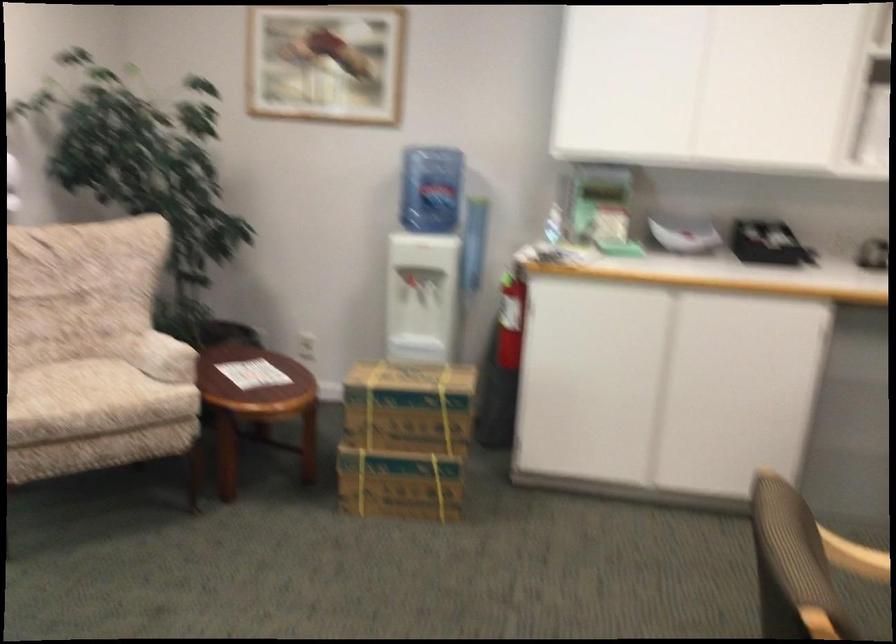
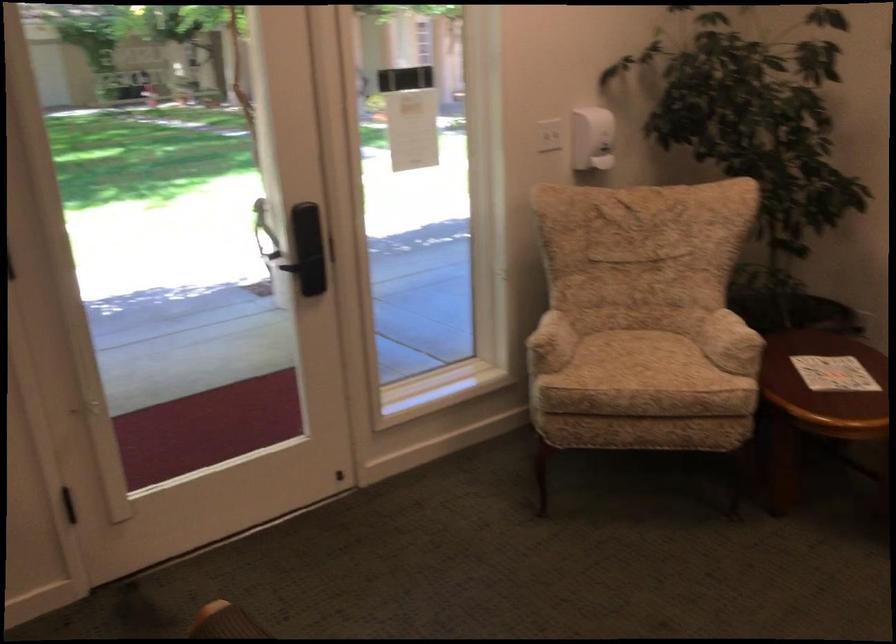
Where in the second image is the point corresponding to (x=166, y=357) from the first image?

(728, 343)